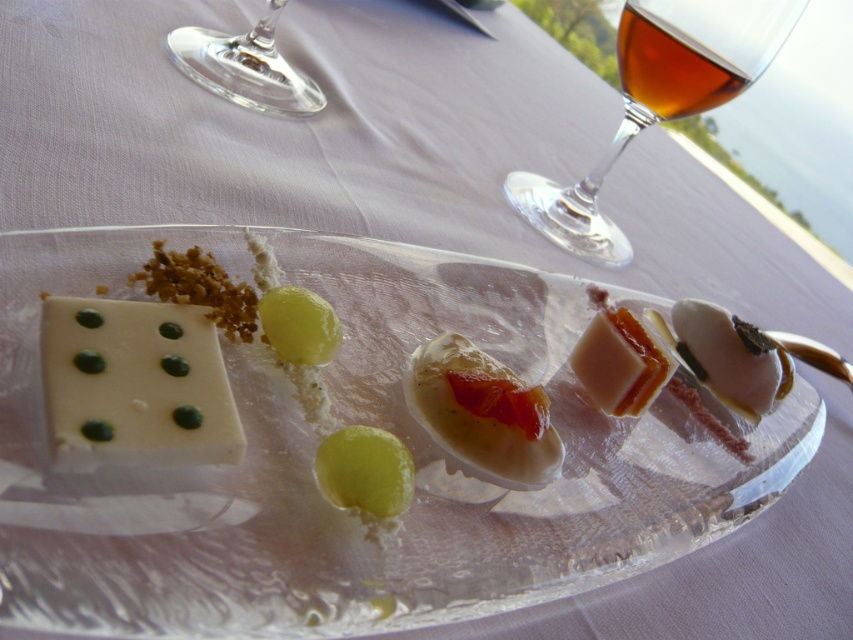
You are a food stylist arranging this appetizer. The amber liquid glass at upper right needs to be moved to the center of the plate. Based on its current position at point 0.105, 0.787, is it closer to the edge or the center of the plate?

The amber liquid glass at upper right is located at point (670, 67). Since the center of the plate would be at coordinates around (426, 320), the glass is closer to the edge of the plate than the center.